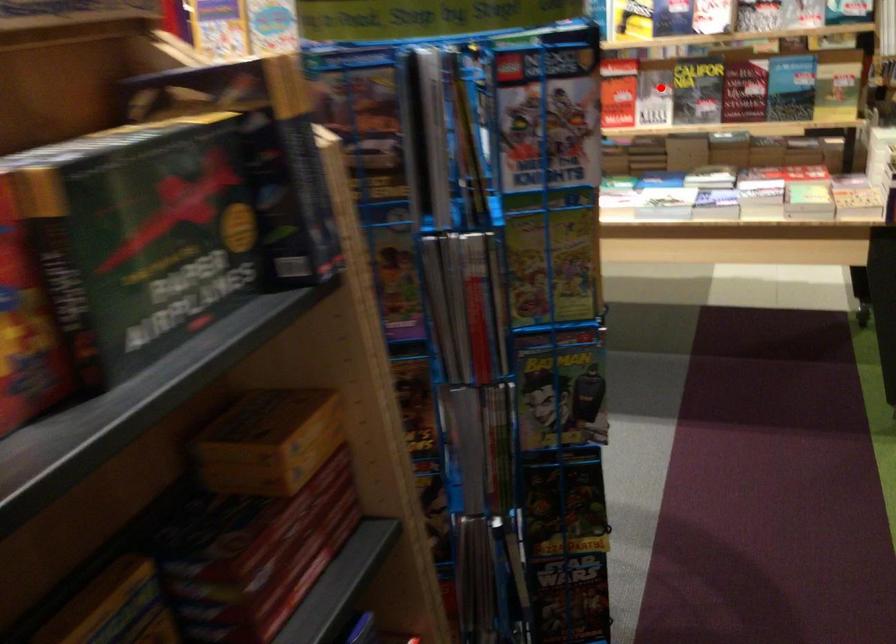
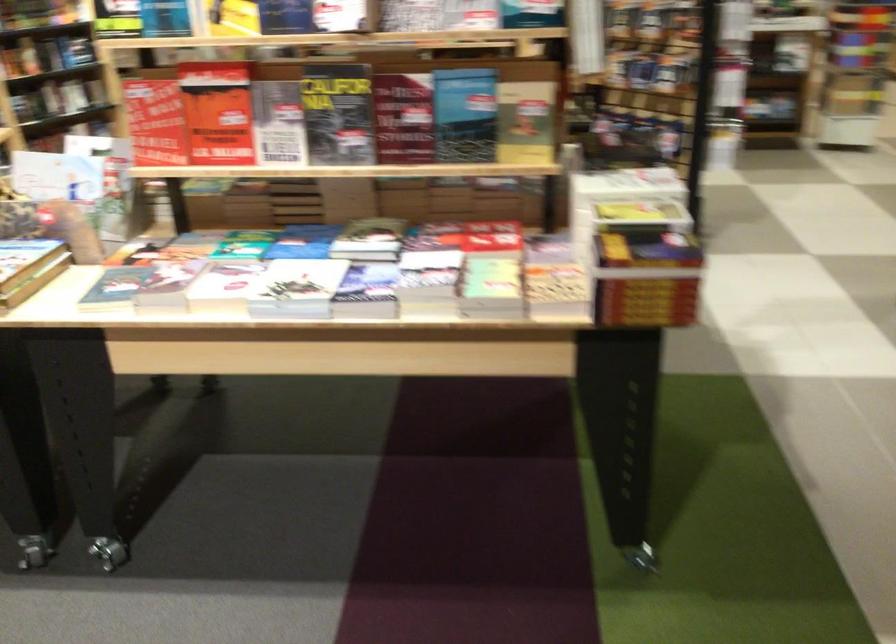
Question: I am providing you with two images of the same scene from different viewpoints. A red point is marked on the first image. Can you still see the location of the red point in image 2?

Choices:
 (A) Yes
 (B) No

Answer: (A)